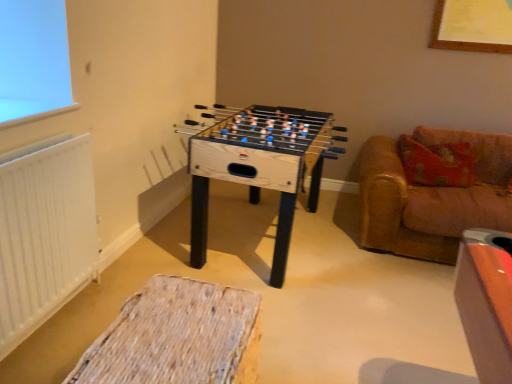
The width and height of the screenshot is (512, 384). I want to click on vacant space to the right of white matte radiator at left, so click(89, 321).